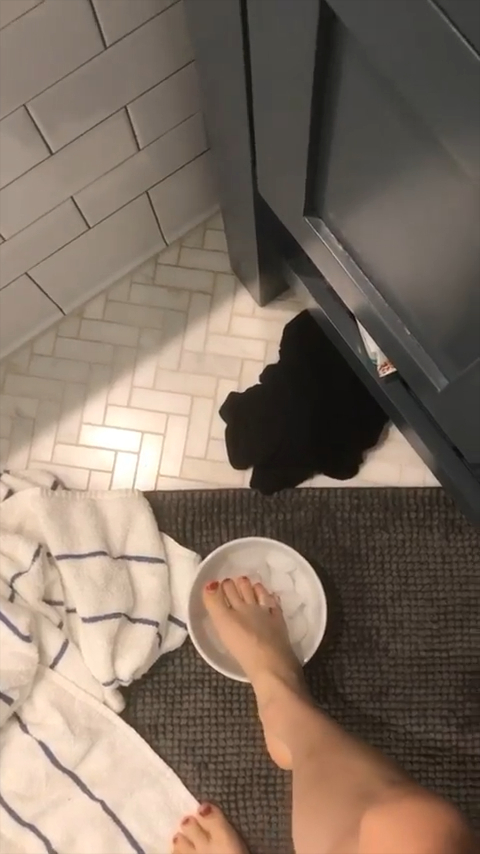
Identify the location of towel. (41, 521).